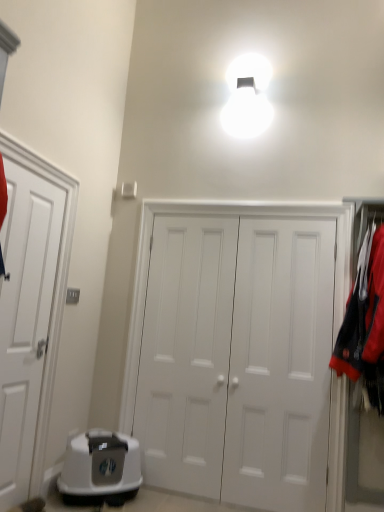
Question: Is the depth of white matte door at center, which is counted as the 3th door, starting from the left, less than that of white matte door at left, the 3th door positioned from the right?

Choices:
 (A) no
 (B) yes

Answer: (A)

Question: Considering the relative sizes of white matte door at center, arranged as the first door when viewed from the right, and white matte door at left, the 3th door positioned from the right, in the image provided, is white matte door at center, arranged as the first door when viewed from the right, shorter than white matte door at left, the 3th door positioned from the right,?

Choices:
 (A) no
 (B) yes

Answer: (A)

Question: Can you confirm if white matte door at center, arranged as the first door when viewed from the right, is positioned to the right of white matte door at left, the 3th door positioned from the right?

Choices:
 (A) yes
 (B) no

Answer: (A)

Question: Is the depth of white matte door at center, which is counted as the 3th door, starting from the left, greater than that of white matte door at left, marked as the first door in a left-to-right arrangement?

Choices:
 (A) no
 (B) yes

Answer: (B)

Question: Can you confirm if white matte door at center, arranged as the first door when viewed from the right, is taller than white matte door at left, the 3th door positioned from the right?

Choices:
 (A) yes
 (B) no

Answer: (A)

Question: Considering the positions of point (13, 485) and point (302, 224), is point (13, 485) closer or farther from the camera than point (302, 224)?

Choices:
 (A) farther
 (B) closer

Answer: (B)

Question: Looking at their shapes, would you say white matte door at left, the 3th door positioned from the right, is wider or thinner than white matte door at center, arranged as the first door when viewed from the right?

Choices:
 (A) thin
 (B) wide

Answer: (B)

Question: Visually, is white matte door at left, the 3th door positioned from the right, positioned to the left or to the right of white matte door at center, arranged as the first door when viewed from the right?

Choices:
 (A) left
 (B) right

Answer: (A)

Question: Is white matte door at left, the 3th door positioned from the right, in front of or behind white matte door at center, which is counted as the 3th door, starting from the left, in the image?

Choices:
 (A) behind
 (B) front

Answer: (B)

Question: From their relative heights in the image, would you say white plastic litter box at lower left is taller or shorter than white matte door at left, marked as the first door in a left-to-right arrangement?

Choices:
 (A) short
 (B) tall

Answer: (A)

Question: From a real-world perspective, is white plastic litter box at lower left positioned above or below white matte door at left, marked as the first door in a left-to-right arrangement?

Choices:
 (A) below
 (B) above

Answer: (A)

Question: From the image's perspective, is white plastic litter box at lower left positioned above or below white matte door at left, the 3th door positioned from the right?

Choices:
 (A) below
 (B) above

Answer: (A)

Question: Is point (115, 468) positioned closer to the camera than point (28, 436)?

Choices:
 (A) farther
 (B) closer

Answer: (A)

Question: Is point (309, 340) positioned closer to the camera than point (49, 217)?

Choices:
 (A) closer
 (B) farther

Answer: (B)

Question: Is white matte door at center, which is counted as the 3th door, starting from the left, in front of or behind white matte door at left, marked as the first door in a left-to-right arrangement, in the image?

Choices:
 (A) front
 (B) behind

Answer: (B)